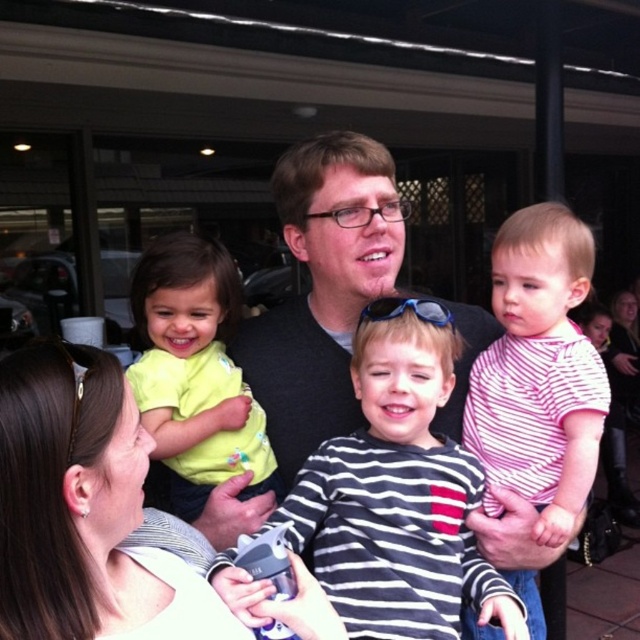
You are standing at the center of the image and want to locate the pink striped shirt at center. According to the coordinates given, in which direction should you move to find it?

The pink striped shirt at center is located at coordinates point (540, 372). Since you are at the center of the image, you should move slightly to the right and upwards to reach the pink striped shirt at center.

You are a photographer setting up for a group photo. You see the white matte shirt at center and the light green fabric shirt at left in your frame. Which shirt should you adjust to ensure both are visible in the photo?

The white matte shirt at center is shorter than the light green fabric shirt at left, so you should adjust the white matte shirt at center to ensure both are visible in the photo.